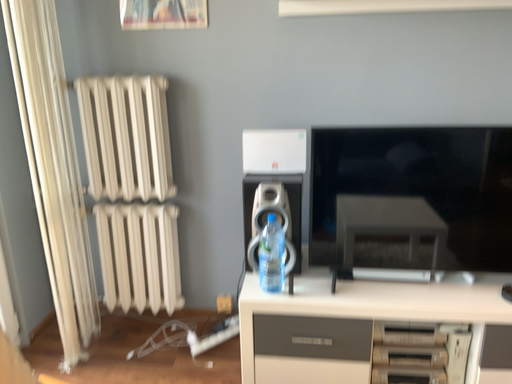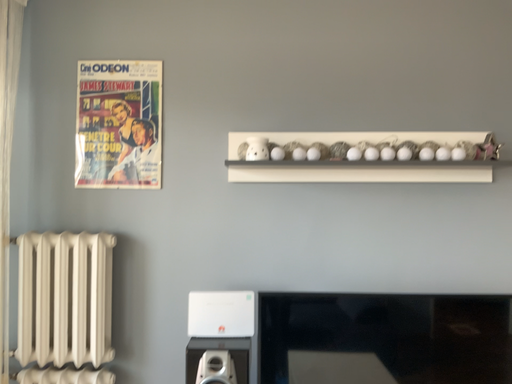
Question: Which way did the camera rotate in the video?

Choices:
 (A) rotated downward
 (B) rotated upward

Answer: (B)